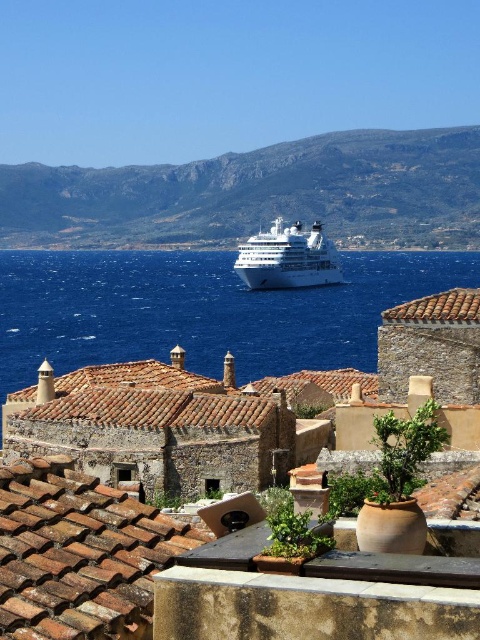
Does blue liquid water at center have a lesser width compared to white glossy cruise ship at center?

No.

Between blue liquid water at center and white glossy cruise ship at center, which one appears on the left side from the viewer's perspective?

From the viewer's perspective, white glossy cruise ship at center appears more on the left side.

Who is more forward, (x=131, y=256) or (x=282, y=236)?

Point (x=282, y=236) is in front.

Where is `blue liquid water at center`? Image resolution: width=480 pixels, height=640 pixels. blue liquid water at center is located at coordinates (202, 310).